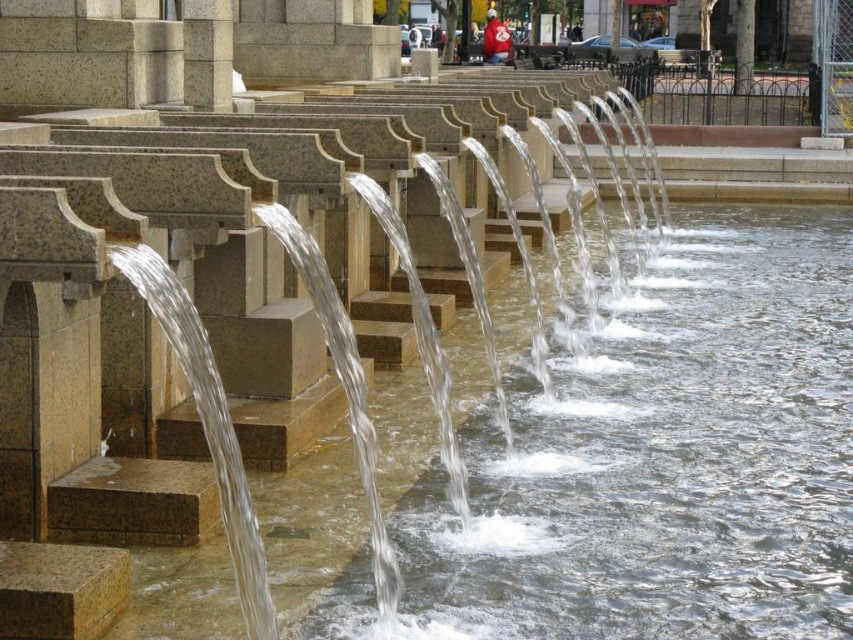
You are standing in front of the water feature and want to take a photo of the granite pillar at center without the clear water at center obstructing the view. Is this possible given their positions?

The clear water at center is in front of the granite pillar at center, so taking a photo of the granite pillar at center without the clear water at center obstructing the view would not be possible as the water is blocking the direct line of sight.

Based on the photo, you are designing a maintenance plan for the water feature and need to know the relative widths of the clear water at center and the granite pillar at center. Which one is wider?

The clear water at center is wider than the granite pillar at center according to the description.

You are standing in front of a modern water feature with multiple tiers of stone blocks forming cascading waterfalls. You notice a specific point marked at coordinates point (323, 605). Considering the point is 66.91 feet away from you, would you say this point is near or far from your current position?

The point (323, 605) is 66.91 feet away from you, so it is far from your current position.